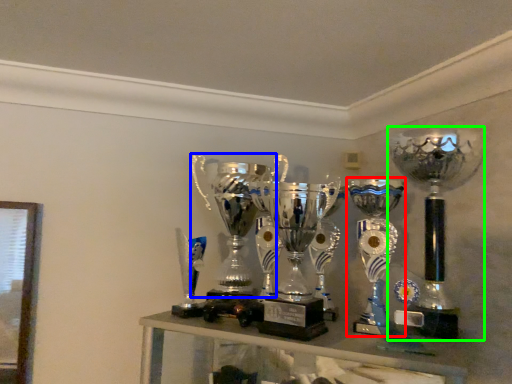
Question: Based on their relative distances, which object is farther from trophy (highlighted by a red box)? Choose from trophy (highlighted by a blue box) and trophy (highlighted by a green box).

Choices:
 (A) trophy
 (B) trophy

Answer: (A)